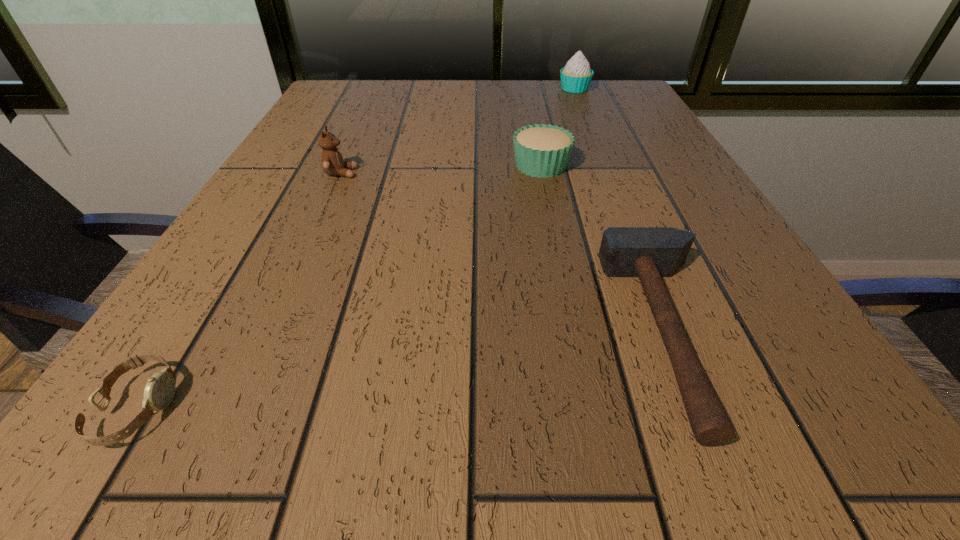
This screenshot has width=960, height=540. Find the location of `free space located on the back of the left cupcake`. free space located on the back of the left cupcake is located at coordinates (x=534, y=127).

Where is `free space located 0.400m on the striking surface of the hammer`? This screenshot has height=540, width=960. free space located 0.400m on the striking surface of the hammer is located at coordinates (290, 333).

Where is `free region located 0.390m on the striking surface of the hammer`? free region located 0.390m on the striking surface of the hammer is located at coordinates (299, 333).

Identify the location of free region located 0.190m on the striking surface of the hammer. The image size is (960, 540). (464, 333).

Find the location of a particular element. The height and width of the screenshot is (540, 960). vacant position located 0.170m on the face of the leftmost object is located at coordinates (332, 407).

Where is `object that is at the far edge`? Image resolution: width=960 pixels, height=540 pixels. object that is at the far edge is located at coordinates point(576,76).

The width and height of the screenshot is (960, 540). What are the coordinates of `hammer situated at the near edge` in the screenshot? It's located at (650, 253).

I want to click on watch positioned at the near edge, so click(159, 391).

The height and width of the screenshot is (540, 960). I want to click on teddy bear at the left edge, so click(332, 161).

Locate an element on the screen. This screenshot has height=540, width=960. watch at the left edge is located at coordinates (159, 391).